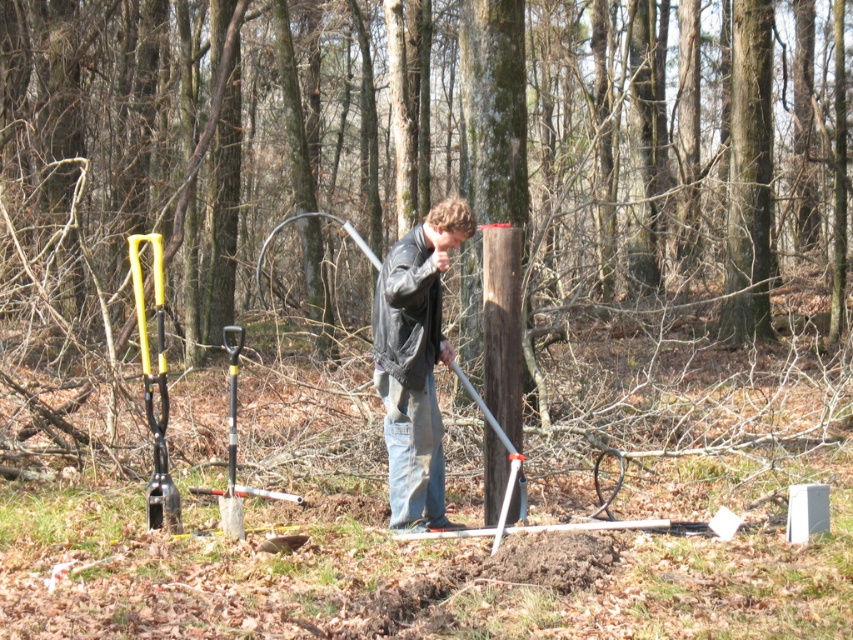
Who is taller, brown wood post at center or metallic yellow tool at left?

brown wood post at center is taller.

Does brown wood post at center have a greater height compared to metallic yellow tool at left?

Indeed, brown wood post at center has a greater height compared to metallic yellow tool at left.

You are a GUI agent. You are given a task and a screenshot of the screen. Output one action in this format:
    pyautogui.click(x=<x>, y=<y>)
    Task: Click on the brown wood post at center
    
    Given the screenshot: What is the action you would take?
    pyautogui.click(x=422, y=148)

Does leather jacket at center appear on the right side of metallic yellow tool at left?

Correct, you'll find leather jacket at center to the right of metallic yellow tool at left.

I want to click on leather jacket at center, so click(x=415, y=364).

The width and height of the screenshot is (853, 640). I want to click on leather jacket at center, so click(x=415, y=364).

The height and width of the screenshot is (640, 853). I want to click on leather jacket at center, so click(415, 364).

Which is behind, point (3, 129) or point (419, 272)?

Point (3, 129)

Is brown wood post at center wider than leather jacket at center?

Yes, brown wood post at center is wider than leather jacket at center.

At what (x,y) coordinates should I click in order to perform the action: click on brown wood post at center. Please return your answer as a coordinate pair (x, y). The width and height of the screenshot is (853, 640). Looking at the image, I should click on (422, 148).